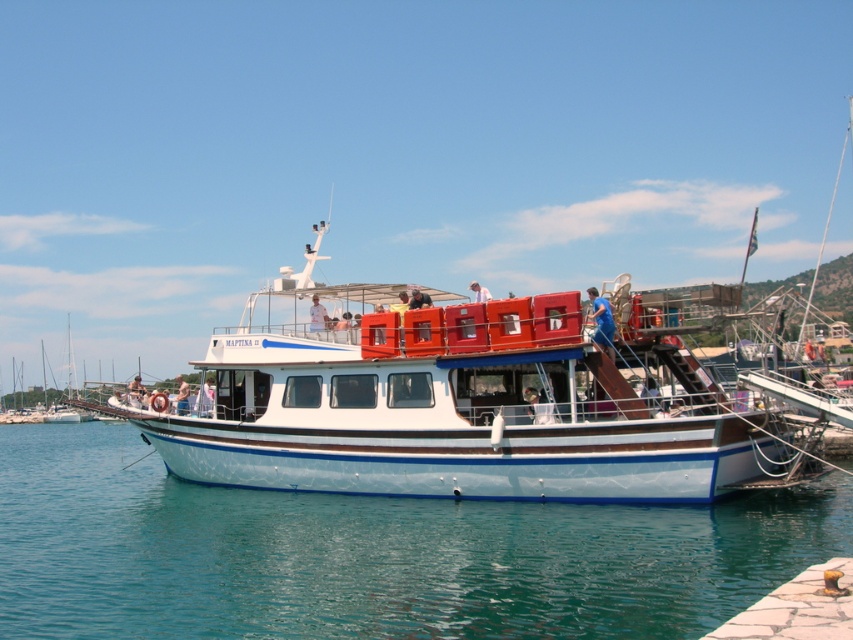
You are standing at the marina and want to reach the point marked on the boat at coordinates point (619, 528). If your walking speed is 1.5 meters per second, how many seconds will it take you to reach that point?

The distance between you and the point (619, 528) is 26.79 meters. At a speed of 1.5 meters per second, it would take approximately 17.86 seconds to reach the point.

You are a photographer on the upper deck of the MAPTINA II boat. You notice two shirts hanging on a rack at upper center. One is blue fabric shirt at upper center and the other is white fabric shirt at upper center. Which shirt takes up more space on the rack?

The blue fabric shirt at upper center takes up more space on the rack because it is bigger than the white fabric shirt at upper center.

Based on the photo, you are a photographer on the upper deck of the MAPTINA II boat. You notice two people wearing shirts of different colors. Which person wearing the blue fabric shirt at upper center or the white fabric shirt at upper center is standing closer to the front of the boat?

The blue fabric shirt at upper center is much taller than the white fabric shirt at upper center, so the person wearing the blue fabric shirt at upper center is standing closer to the front of the boat.